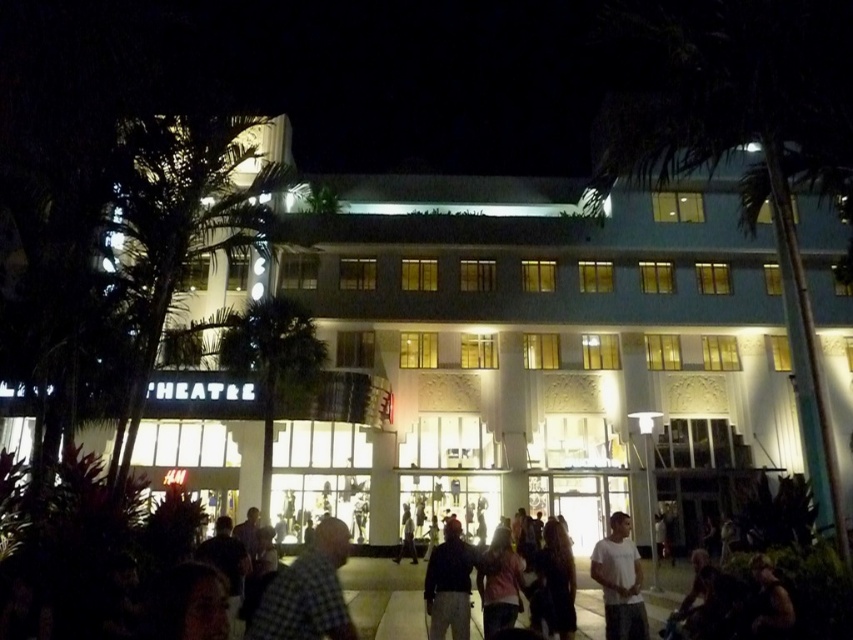
Locate an element on the screen. The height and width of the screenshot is (640, 853). green leafy palm tree at upper right is located at coordinates (741, 140).

Which is behind, point (671, 116) or point (167, 189)?

The point (167, 189) is behind.

I want to click on green leafy palm tree at upper right, so click(x=741, y=140).

Who is more distant from viewer, (270, 449) or (444, 604)?

Point (270, 449)

Does green leafy palm tree at center have a greater height compared to dark gray fabric jacket at center?

Correct, green leafy palm tree at center is much taller as dark gray fabric jacket at center.

Is point (242, 348) farther from camera compared to point (459, 564)?

Yes, it is behind point (459, 564).

The width and height of the screenshot is (853, 640). Find the location of `green leafy palm tree at center`. green leafy palm tree at center is located at coordinates (273, 362).

Is dark clothing at center positioned behind green leafy palm tree at center?

That is False.

Consider the image. Measure the distance between dark clothing at center and camera.

dark clothing at center is 20.84 meters from camera.

This screenshot has width=853, height=640. Identify the location of dark clothing at center. (384, 596).